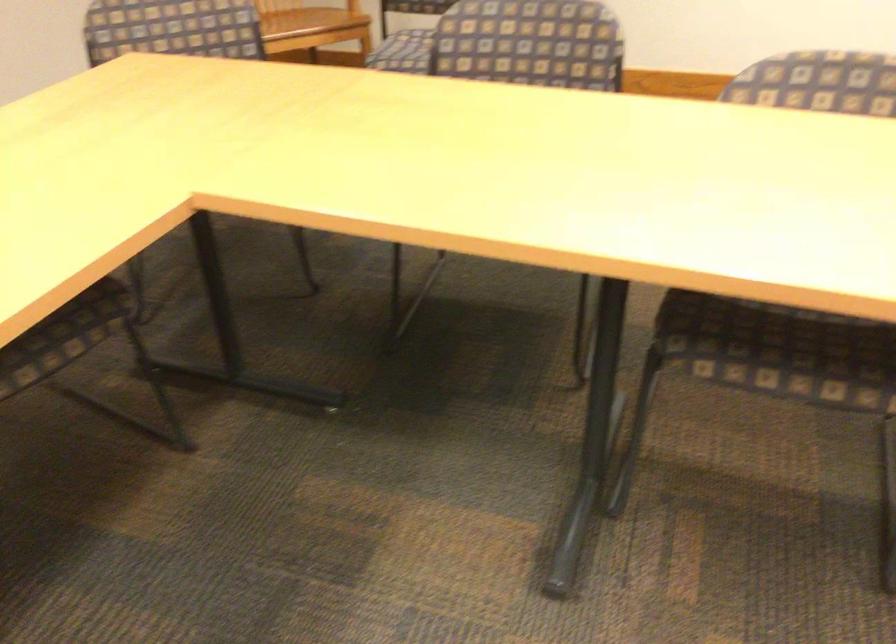
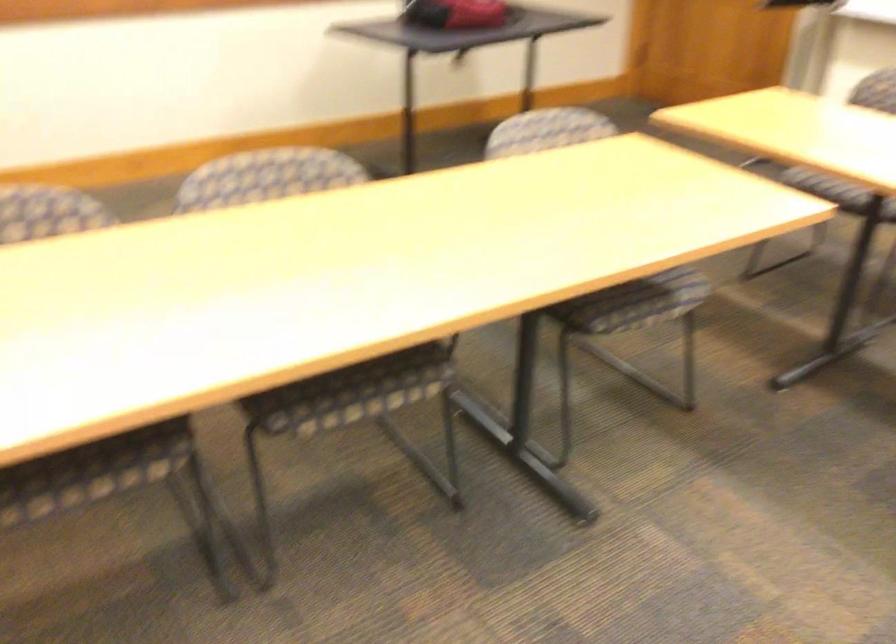
Locate, in the second image, the point that corresponds to point 810,348 in the first image.

(92, 471)